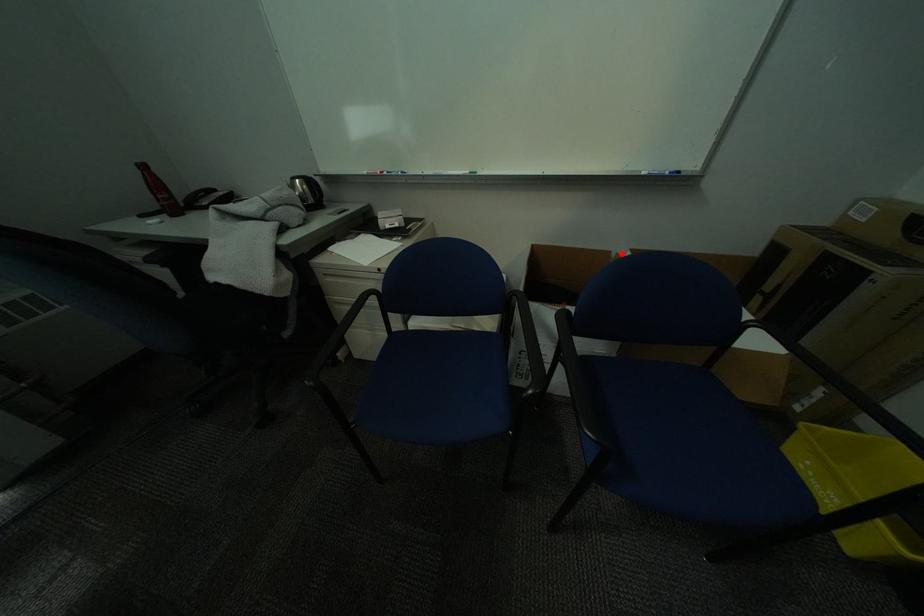
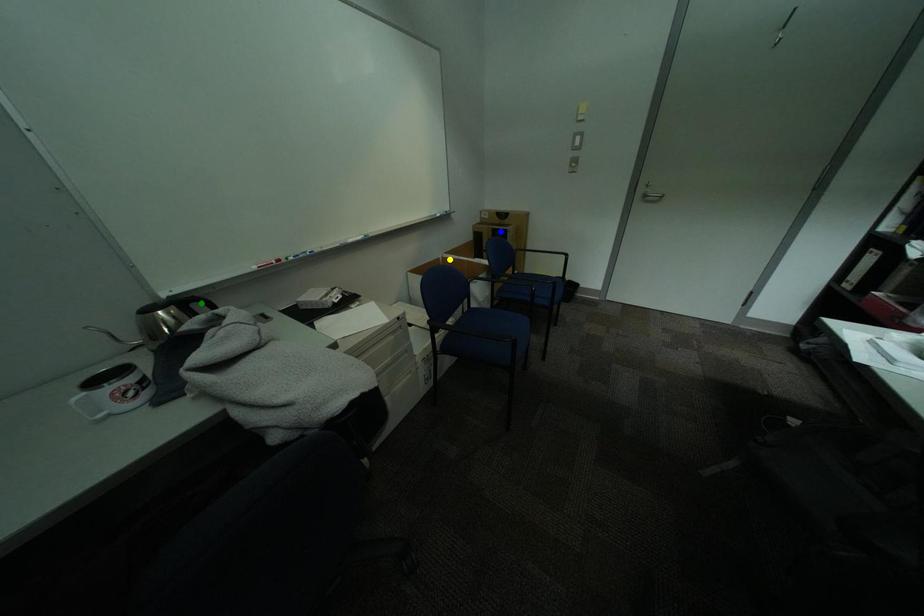
Question: I am providing you with two images of the same scene from different viewpoints. A red point is marked on the first image. You are given multiple points on the second image. Which spot in image 2 lines up with the point in image 1?

Choices:
 (A) yellow point
 (B) blue point
 (C) green point

Answer: (A)